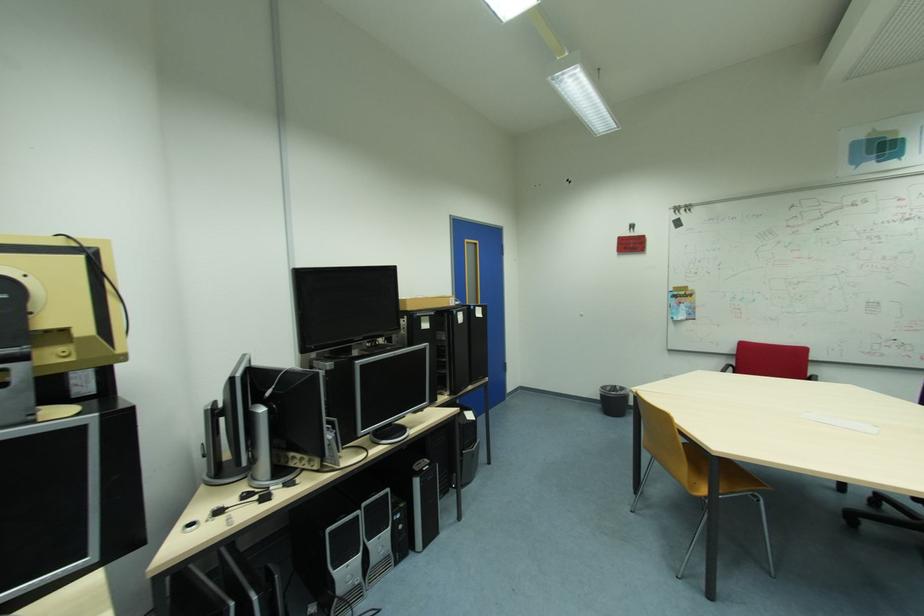
Find the location of a particular element. The image size is (924, 616). black trash can is located at coordinates [x=614, y=400].